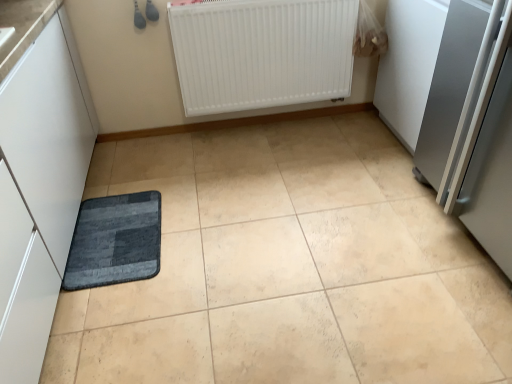
Question: Can you confirm if white matte radiator at upper center is bigger than satin silver refrigerator at right?

Choices:
 (A) no
 (B) yes

Answer: (A)

Question: Considering the relative sizes of white matte radiator at upper center and satin silver refrigerator at right in the image provided, is white matte radiator at upper center smaller than satin silver refrigerator at right?

Choices:
 (A) no
 (B) yes

Answer: (B)

Question: Is white matte radiator at upper center wider than satin silver refrigerator at right?

Choices:
 (A) yes
 (B) no

Answer: (B)

Question: Is white matte radiator at upper center facing away from satin silver refrigerator at right?

Choices:
 (A) yes
 (B) no

Answer: (B)

Question: Considering the relative sizes of white matte radiator at upper center and satin silver refrigerator at right in the image provided, is white matte radiator at upper center taller than satin silver refrigerator at right?

Choices:
 (A) no
 (B) yes

Answer: (A)

Question: In terms of width, does white matte radiator at upper center look wider or thinner when compared to dark gray textured mat at lower left?

Choices:
 (A) thin
 (B) wide

Answer: (A)

Question: Is white matte radiator at upper center inside the boundaries of dark gray textured mat at lower left, or outside?

Choices:
 (A) outside
 (B) inside

Answer: (A)

Question: From the image's perspective, is white matte radiator at upper center located above or below dark gray textured mat at lower left?

Choices:
 (A) below
 (B) above

Answer: (B)

Question: Considering the positions of point (300, 39) and point (73, 286), is point (300, 39) closer or farther from the camera than point (73, 286)?

Choices:
 (A) closer
 (B) farther

Answer: (B)

Question: Considering the positions of dark gray textured mat at lower left and white matte radiator at upper center in the image, is dark gray textured mat at lower left taller or shorter than white matte radiator at upper center?

Choices:
 (A) short
 (B) tall

Answer: (A)

Question: Considering the positions of point (102, 221) and point (223, 21), is point (102, 221) closer or farther from the camera than point (223, 21)?

Choices:
 (A) closer
 (B) farther

Answer: (A)

Question: Is dark gray textured mat at lower left inside or outside of white matte radiator at upper center?

Choices:
 (A) inside
 (B) outside

Answer: (B)

Question: In the image, is dark gray textured mat at lower left positioned in front of or behind white matte radiator at upper center?

Choices:
 (A) front
 (B) behind

Answer: (A)

Question: Relative to satin silver refrigerator at right, is white matte radiator at upper center in front or behind?

Choices:
 (A) front
 (B) behind

Answer: (B)

Question: Is point (181, 66) positioned closer to the camera than point (463, 120)?

Choices:
 (A) closer
 (B) farther

Answer: (B)